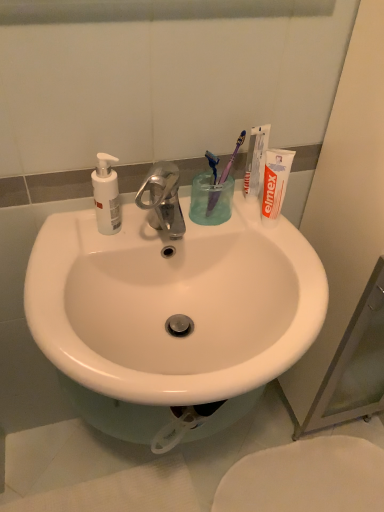
Question: From the image's perspective, is white glossy sink at center above or below white glossy toilet at lower right?

Choices:
 (A) below
 (B) above

Answer: (B)

Question: From a real-world perspective, is white glossy sink at center physically located above or below white glossy toilet at lower right?

Choices:
 (A) above
 (B) below

Answer: (A)

Question: Estimate the real-world distances between objects in this image. Which object is farther from the white matte soap dispenser at left?

Choices:
 (A) purple plastic toothbrush at upper right, the 1th toothbrush in the right-to-left sequence
 (B) purple plastic toothbrush at upper center, which appears as the 2th toothbrush when viewed from the right
 (C) white glossy sink at center
 (D) white matte toothpaste tube at upper right
 (E) transparent plastic cup at center

Answer: (D)

Question: Considering the real-world distances, which object is farthest from the transparent plastic cup at center?

Choices:
 (A) purple plastic toothbrush at upper center, which appears as the first toothbrush when viewed from the left
 (B) white glossy toilet at lower right
 (C) white matte toothpaste tube at upper right
 (D) purple plastic toothbrush at upper right, arranged as the second toothbrush when viewed from the left
 (E) white matte toothpaste at upper right

Answer: (B)